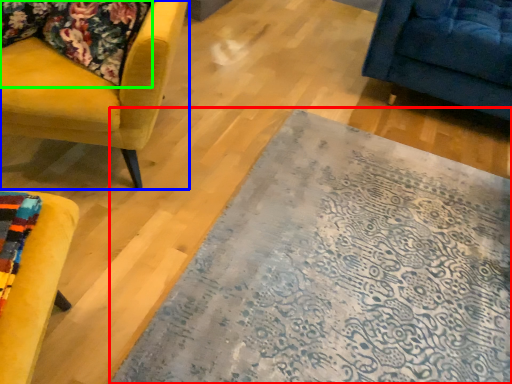
Question: Which object is the farthest from mat (highlighted by a red box)? Choose among these: chair (highlighted by a blue box) or fabric (highlighted by a green box).

Choices:
 (A) chair
 (B) fabric

Answer: (B)